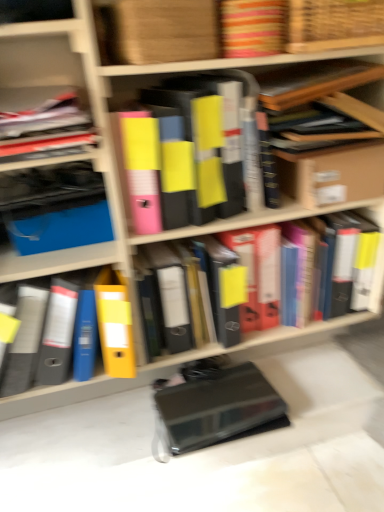
Find the location of a particular element. This screenshot has width=384, height=512. vacant region above black matte book at lower center (from a real-world perspective) is located at coordinates (204, 406).